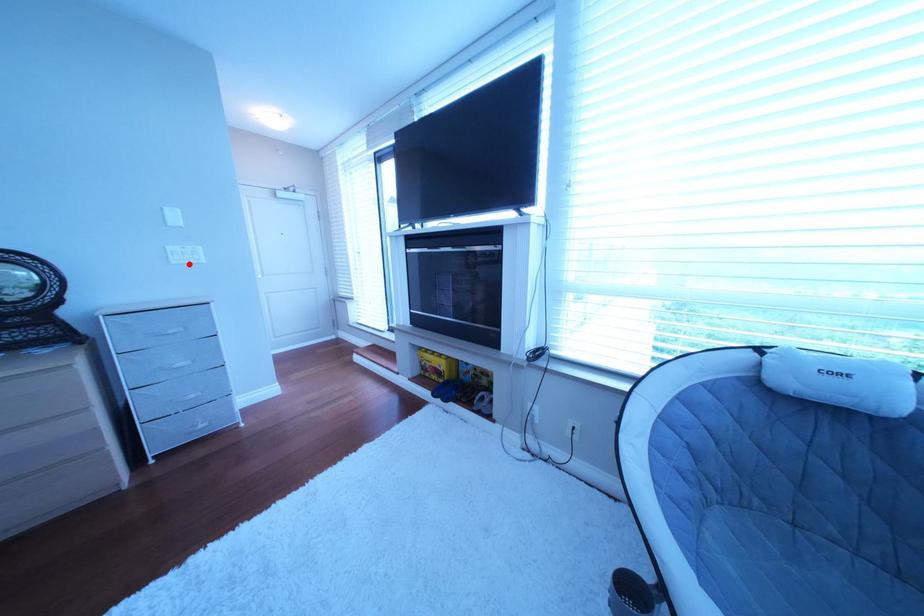
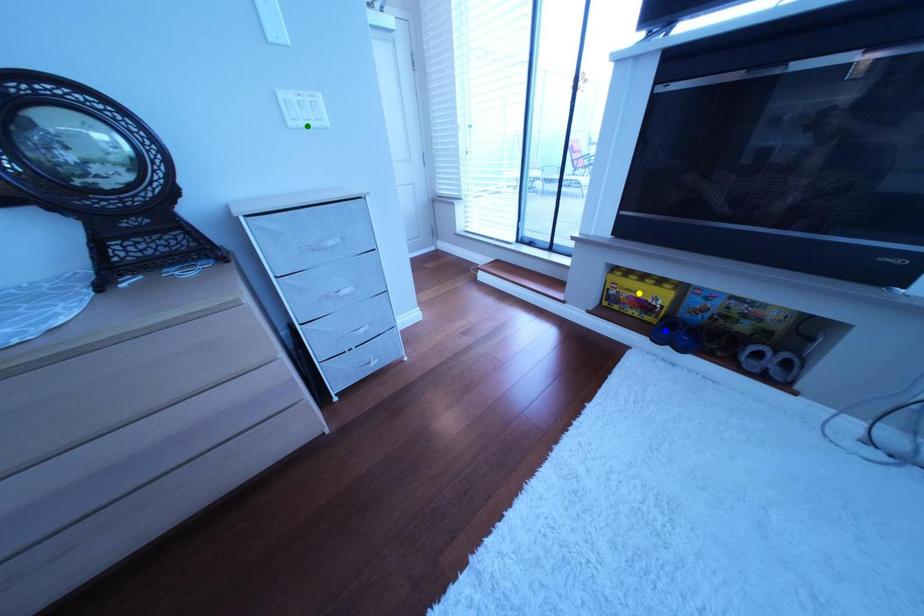
Question: I am providing you with two images of the same scene from different viewpoints. A red point is marked on the first image. You are given multiple points on the second image. Which spot in image 2 lines up with the point in image 1?

Choices:
 (A) yellow point
 (B) blue point
 (C) green point

Answer: (C)